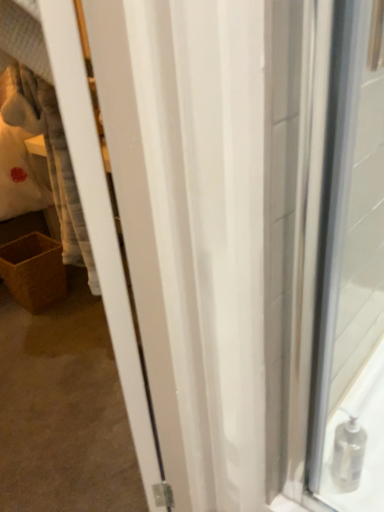
Measure the distance between point (x=58, y=253) and camera.

Point (x=58, y=253) and camera are 1.81 meters apart.

What do you see at coordinates (34, 271) in the screenshot? I see `brown woven basket at lower left` at bounding box center [34, 271].

Identify the location of brown woven basket at lower left. (34, 271).

Find the location of a particular element. The width and height of the screenshot is (384, 512). clear plastic soap dispenser at lower right is located at coordinates (357, 443).

Measure the distance between clear plastic soap dispenser at lower right and camera.

35.31 inches.

What do you see at coordinates (357, 443) in the screenshot? I see `clear plastic soap dispenser at lower right` at bounding box center [357, 443].

Locate an element on the screen. brown woven basket at lower left is located at coordinates pyautogui.click(x=34, y=271).

Is brown woven basket at lower left to the left of clear plastic soap dispenser at lower right from the viewer's perspective?

Indeed, brown woven basket at lower left is positioned on the left side of clear plastic soap dispenser at lower right.

Is brown woven basket at lower left closer to the viewer compared to clear plastic soap dispenser at lower right?

No, it is not.

Between point (20, 252) and point (333, 447), which one is positioned behind?

Positioned behind is point (20, 252).

From the image's perspective, would you say brown woven basket at lower left is positioned over clear plastic soap dispenser at lower right?

Yes.

From a real-world perspective, which is physically below, brown woven basket at lower left or clear plastic soap dispenser at lower right?

In real-world perspective, brown woven basket at lower left is lower.

Looking at their sizes, would you say brown woven basket at lower left is wider or thinner than clear plastic soap dispenser at lower right?

Clearly, brown woven basket at lower left has more width compared to clear plastic soap dispenser at lower right.

Is brown woven basket at lower left taller than clear plastic soap dispenser at lower right?

Yes.

Considering the relative sizes of brown woven basket at lower left and clear plastic soap dispenser at lower right in the image provided, is brown woven basket at lower left smaller than clear plastic soap dispenser at lower right?

Incorrect, brown woven basket at lower left is not smaller in size than clear plastic soap dispenser at lower right.

Is brown woven basket at lower left inside or outside of clear plastic soap dispenser at lower right?

brown woven basket at lower left is outside clear plastic soap dispenser at lower right.

Is brown woven basket at lower left not near clear plastic soap dispenser at lower right?

brown woven basket at lower left is positioned a significant distance from clear plastic soap dispenser at lower right.

Based on the photo, is brown woven basket at lower left oriented away from clear plastic soap dispenser at lower right?

No, brown woven basket at lower left is not facing the opposite direction of clear plastic soap dispenser at lower right.

In the scene shown: What's the angular difference between brown woven basket at lower left and clear plastic soap dispenser at lower right's facing directions?

The angular difference between brown woven basket at lower left and clear plastic soap dispenser at lower right is 0.42 degrees.

Identify the location of bath lying below the brown woven basket at lower left (from the image's perspective). Image resolution: width=384 pixels, height=512 pixels. (357, 443).

Consider the image. Is clear plastic soap dispenser at lower right to the right of brown woven basket at lower left from the viewer's perspective?

Indeed, clear plastic soap dispenser at lower right is positioned on the right side of brown woven basket at lower left.

In the scene shown: In the image, is clear plastic soap dispenser at lower right positioned in front of or behind brown woven basket at lower left?

clear plastic soap dispenser at lower right is in front of brown woven basket at lower left.

Is point (357, 447) positioned in front of point (40, 264)?

That is True.

From the image's perspective, who appears lower, clear plastic soap dispenser at lower right or brown woven basket at lower left?

clear plastic soap dispenser at lower right is shown below in the image.

From a real-world perspective, between clear plastic soap dispenser at lower right and brown woven basket at lower left, who is vertically higher?

In real-world perspective, clear plastic soap dispenser at lower right is above.

Considering the sizes of objects clear plastic soap dispenser at lower right and brown woven basket at lower left in the image provided, who is thinner, clear plastic soap dispenser at lower right or brown woven basket at lower left?

clear plastic soap dispenser at lower right.

Does clear plastic soap dispenser at lower right have a lesser height compared to brown woven basket at lower left?

Indeed, clear plastic soap dispenser at lower right has a lesser height compared to brown woven basket at lower left.

Between clear plastic soap dispenser at lower right and brown woven basket at lower left, which one has larger size?

With larger size is brown woven basket at lower left.

Is clear plastic soap dispenser at lower right not inside brown woven basket at lower left?

That's correct, clear plastic soap dispenser at lower right is outside of brown woven basket at lower left.

Is clear plastic soap dispenser at lower right in contact with brown woven basket at lower left?

No, clear plastic soap dispenser at lower right is not making contact with brown woven basket at lower left.

Could you tell me if clear plastic soap dispenser at lower right is facing brown woven basket at lower left?

No.

The image size is (384, 512). In order to click on bath below the brown woven basket at lower left (from the image's perspective) in this screenshot , I will do `click(357, 443)`.

The image size is (384, 512). Find the location of `basket that is on the left side of clear plastic soap dispenser at lower right`. basket that is on the left side of clear plastic soap dispenser at lower right is located at coordinates (34, 271).

Identify the location of bath in front of the brown woven basket at lower left. This screenshot has width=384, height=512. (357, 443).